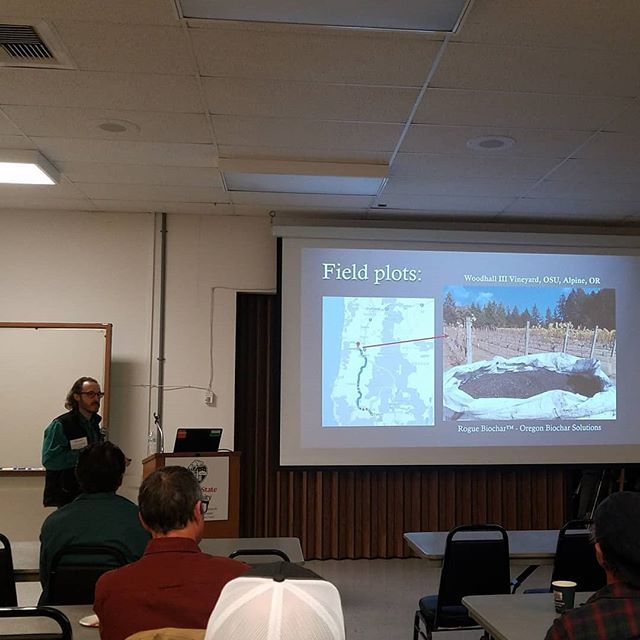
Locate an element on the screen. This screenshot has height=640, width=640. black chair at white table on right side of room - right chair is located at coordinates (456, 580).